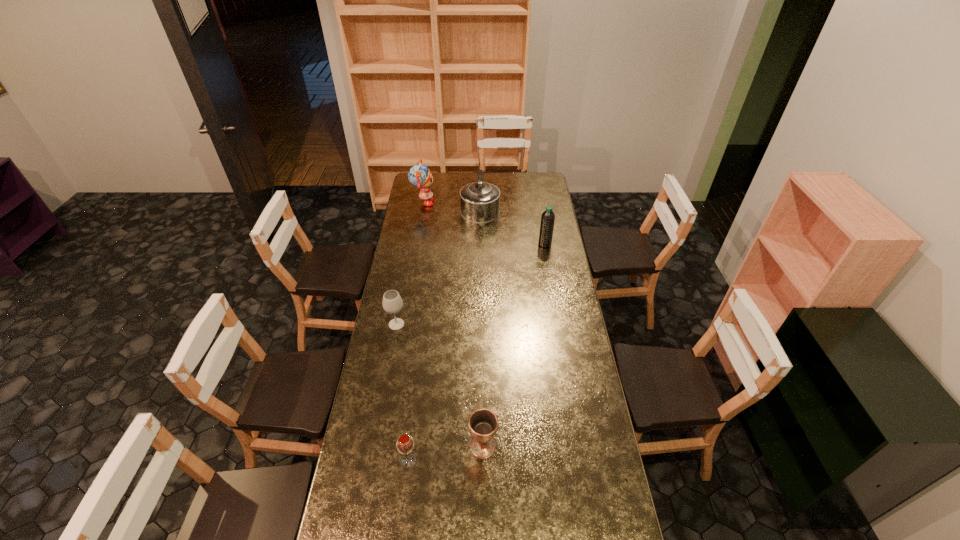
Image resolution: width=960 pixels, height=540 pixels. In order to click on kettle in this screenshot , I will do `click(479, 201)`.

In order to click on doll in this screenshot , I will do `click(419, 175)`.

Find the location of a particular element. This screenshot has width=960, height=540. water bottle is located at coordinates (548, 217).

Where is `the rightmost object`? The width and height of the screenshot is (960, 540). the rightmost object is located at coordinates (548, 217).

This screenshot has height=540, width=960. In order to click on the third nearest object in this screenshot , I will do `click(392, 303)`.

Locate an element on the screen. the taller wineglass is located at coordinates (392, 303).

Where is `chalice`? This screenshot has width=960, height=540. chalice is located at coordinates (483, 423).

Identify the location of the shorter wineglass. Image resolution: width=960 pixels, height=540 pixels. (405, 444).

Where is `the right wineglass`? the right wineglass is located at coordinates (405, 444).

Find the location of a particular element. Image resolution: width=960 pixels, height=540 pixels. vacant space located 0.330m with the spout at the front of the kettle is located at coordinates (480, 270).